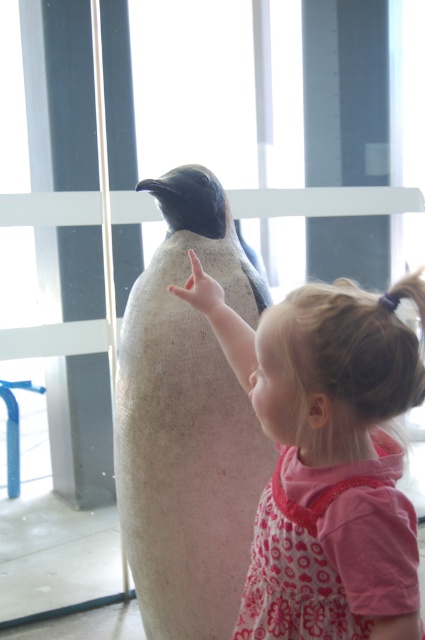
You are a photographer trying to capture the child and the penguin model in the best possible way. You notice two points marked in the image. The first point is at coordinate point (x=333, y=465) and the second point is at coordinate point (x=229, y=468). Which of these two points is closer to the camera?

Point (x=333, y=465) is closer to the camera than point (x=229, y=468) according to the description.